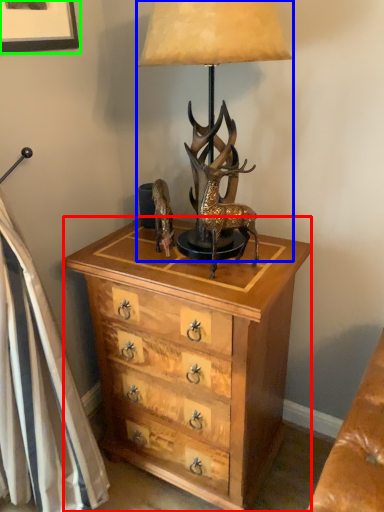
Question: Which object is the closest to the chest of drawers (highlighted by a red box)? Choose among these: lamp (highlighted by a blue box) or picture frame (highlighted by a green box).

Choices:
 (A) lamp
 (B) picture frame

Answer: (A)